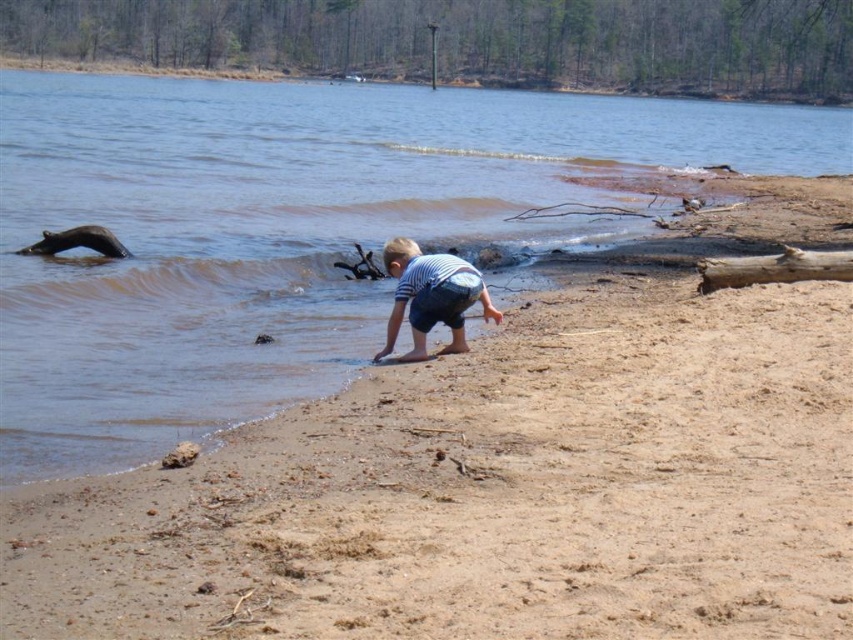
Can you confirm if brown sandy beach at lower center is bigger than striped cotton shirt at lower center?

Correct, brown sandy beach at lower center is larger in size than striped cotton shirt at lower center.

Is brown sandy beach at lower center positioned before striped cotton shirt at lower center?

That is True.

Where is `brown sandy beach at lower center`? brown sandy beach at lower center is located at coordinates (508, 476).

Can you confirm if brown sandy beach at lower center is positioned to the left of brown rough wood log at right?

Yes, brown sandy beach at lower center is to the left of brown rough wood log at right.

Is point (242, 604) closer to camera compared to point (762, 257)?

Yes, point (242, 604) is closer to viewer.

Where is `brown sandy beach at lower center`? This screenshot has width=853, height=640. brown sandy beach at lower center is located at coordinates (508, 476).

Which is more to the right, striped cotton shirt at lower center or brown rough wood log at right?

brown rough wood log at right

Can you confirm if striped cotton shirt at lower center is positioned to the right of brown rough wood log at right?

No, striped cotton shirt at lower center is not to the right of brown rough wood log at right.

Between point (447, 291) and point (708, 259), which one is positioned in front?

Point (447, 291) is more forward.

The height and width of the screenshot is (640, 853). I want to click on striped cotton shirt at lower center, so click(431, 296).